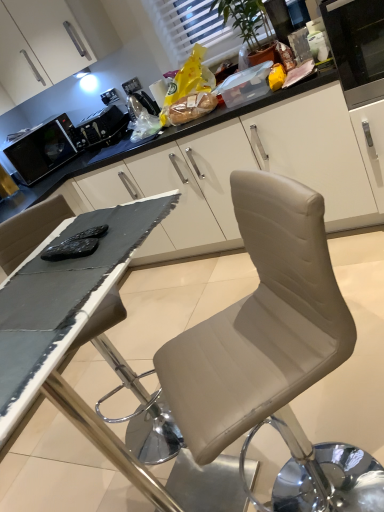
Question: In the image, is black matte microwave at left, the second appliance when ordered from right to left, positioned in front of or behind white textured window at upper center?

Choices:
 (A) front
 (B) behind

Answer: (B)

Question: Would you say black matte microwave at left, the second appliance when ordered from right to left, is to the left or to the right of white textured window at upper center in the picture?

Choices:
 (A) left
 (B) right

Answer: (A)

Question: Which object is positioned farthest from the satin black toaster at upper center, the 2th appliance viewed from the left?

Choices:
 (A) black matte table at center
 (B) black matte microwave at left, which is the 1th appliance in left-to-right order
 (C) white textured window at upper center
 (D) beige leather chair at center
 (E) matte plastic bag of bread at upper center

Answer: (D)

Question: Based on their relative distances, which object is nearer to the beige leather chair at center?

Choices:
 (A) white textured window at upper center
 (B) black matte table at center
 (C) black matte microwave at left, which is the 1th appliance in left-to-right order
 (D) matte plastic bag of bread at upper center
 (E) satin black toaster at upper center, the 2th appliance viewed from the left

Answer: (B)